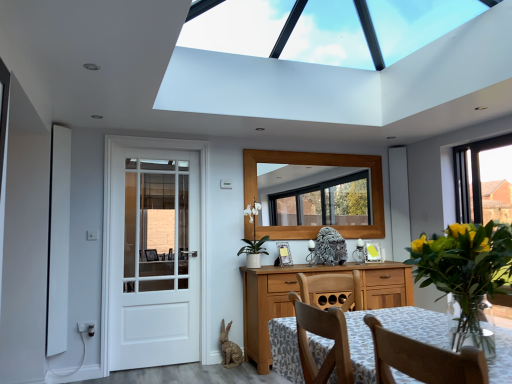
Question: Are translucent glass vase at right and white painted wood door at left making contact?

Choices:
 (A) yes
 (B) no

Answer: (B)

Question: Considering the relative sizes of translucent glass vase at right and white painted wood door at left in the image provided, is translucent glass vase at right wider than white painted wood door at left?

Choices:
 (A) no
 (B) yes

Answer: (B)

Question: From the image's perspective, is translucent glass vase at right located above white painted wood door at left?

Choices:
 (A) no
 (B) yes

Answer: (B)

Question: Is translucent glass vase at right behind white painted wood door at left?

Choices:
 (A) no
 (B) yes

Answer: (A)

Question: Considering the relative sizes of translucent glass vase at right and white painted wood door at left in the image provided, is translucent glass vase at right shorter than white painted wood door at left?

Choices:
 (A) no
 (B) yes

Answer: (B)

Question: Is point (244, 281) positioned closer to the camera than point (509, 266)?

Choices:
 (A) farther
 (B) closer

Answer: (A)

Question: Which is correct: wooden cabinet at center is inside translucent glass vase at right, or outside of it?

Choices:
 (A) inside
 (B) outside

Answer: (B)

Question: In the image, is wooden cabinet at center on the left side or the right side of translucent glass vase at right?

Choices:
 (A) right
 (B) left

Answer: (B)

Question: From a real-world perspective, is wooden cabinet at center positioned above or below translucent glass vase at right?

Choices:
 (A) below
 (B) above

Answer: (A)

Question: Considering their positions, is white painted wood door at left located in front of or behind wooden table at center?

Choices:
 (A) behind
 (B) front

Answer: (A)

Question: From a real-world perspective, relative to wooden table at center, is white painted wood door at left vertically above or below?

Choices:
 (A) above
 (B) below

Answer: (A)

Question: In terms of size, does white painted wood door at left appear bigger or smaller than wooden table at center?

Choices:
 (A) big
 (B) small

Answer: (A)

Question: Would you say white painted wood door at left is to the left or to the right of wooden table at center in the picture?

Choices:
 (A) left
 (B) right

Answer: (A)

Question: Considering the positions of translucent glass vase at right and wooden frame mirror at center in the image, is translucent glass vase at right taller or shorter than wooden frame mirror at center?

Choices:
 (A) tall
 (B) short

Answer: (B)

Question: Considering their positions, is translucent glass vase at right located in front of or behind wooden frame mirror at center?

Choices:
 (A) front
 (B) behind

Answer: (A)